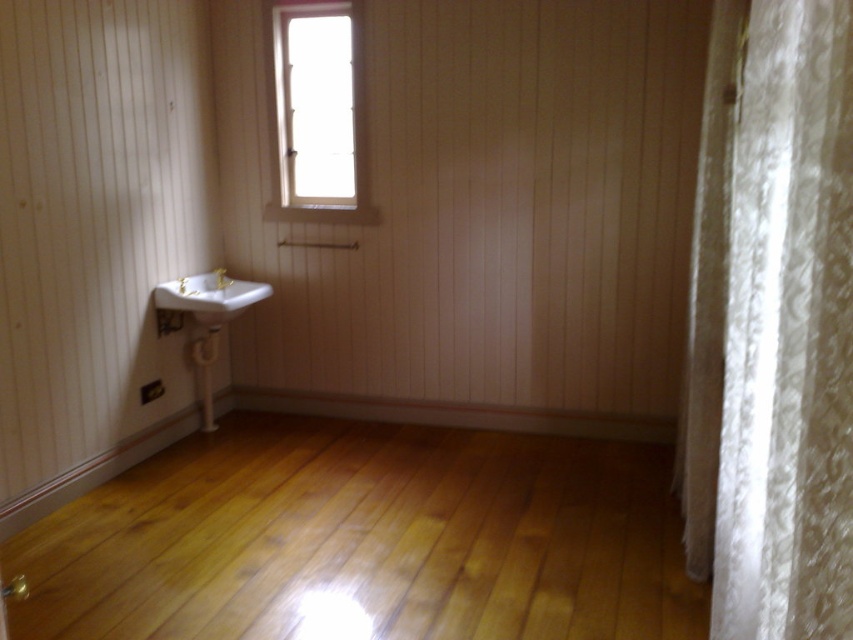
Is point (851, 244) closer to viewer compared to point (712, 1)?

Yes, it is in front of point (712, 1).

In the scene shown: Measure the distance between white lace curtain at right and white textured curtain at right.

A: white lace curtain at right and white textured curtain at right are 95.01 centimeters apart.

The height and width of the screenshot is (640, 853). Find the location of `white lace curtain at right`. white lace curtain at right is located at coordinates (788, 336).

Who is higher up, transparent glass window at upper center or white glossy sink at lower left?

transparent glass window at upper center is above.

Is transparent glass window at upper center below white glossy sink at lower left?

→ No.

Is point (317, 38) farther from viewer compared to point (161, 282)?

Yes.

Locate an element on the screen. The image size is (853, 640). transparent glass window at upper center is located at coordinates (317, 112).

Is white glossy sink at lower left above gold metallic faucet at left?

No, white glossy sink at lower left is not above gold metallic faucet at left.

Does point (215, 280) come closer to viewer compared to point (180, 289)?

No, it is behind (180, 289).

Locate an element on the screen. white glossy sink at lower left is located at coordinates (207, 298).